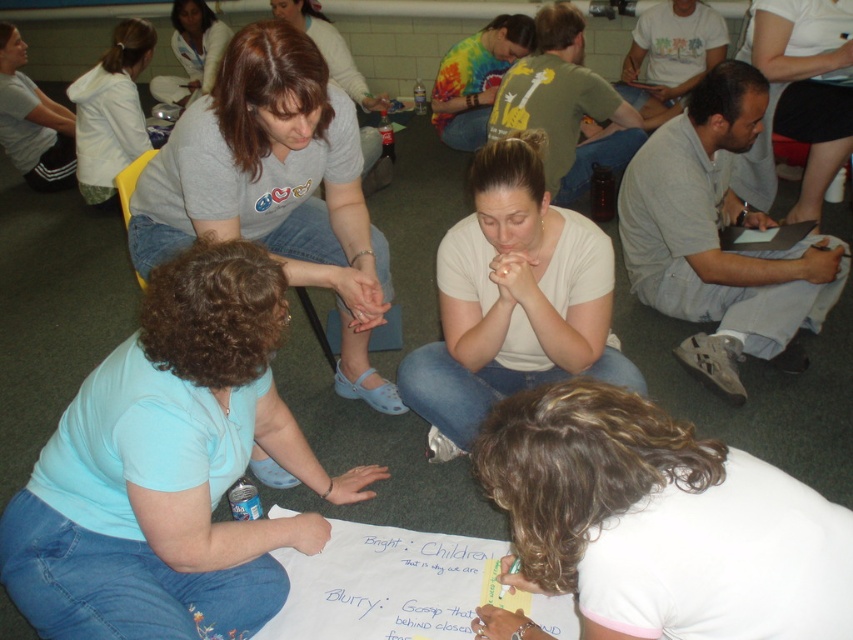
Is white matte shirt at lower center above white matte shirt at upper right?

No.

Based on the photo, is white matte shirt at lower center below white matte shirt at upper right?

Yes, white matte shirt at lower center is below white matte shirt at upper right.

Describe the element at coordinates (660, 522) in the screenshot. I see `white matte shirt at lower center` at that location.

The image size is (853, 640). What are the coordinates of `white matte shirt at lower center` in the screenshot? It's located at (660, 522).

Between white matte shirt at center and white matte shirt at upper left, which one has more height?

With more height is white matte shirt at upper left.

Does white matte shirt at center have a smaller size compared to white matte shirt at upper left?

No, white matte shirt at center is not smaller than white matte shirt at upper left.

Measure the distance between white matte shirt at center and camera.

5.66 feet

This screenshot has width=853, height=640. I want to click on white matte shirt at center, so click(x=512, y=300).

Between matte gray shirt at center and white matte shirt at center, which one is positioned higher?

matte gray shirt at center is above.

Can you confirm if matte gray shirt at center is bigger than white matte shirt at center?

Correct, matte gray shirt at center is larger in size than white matte shirt at center.

Locate an element on the screen. matte gray shirt at center is located at coordinates (276, 188).

Where is `matte gray shirt at center`? matte gray shirt at center is located at coordinates (276, 188).